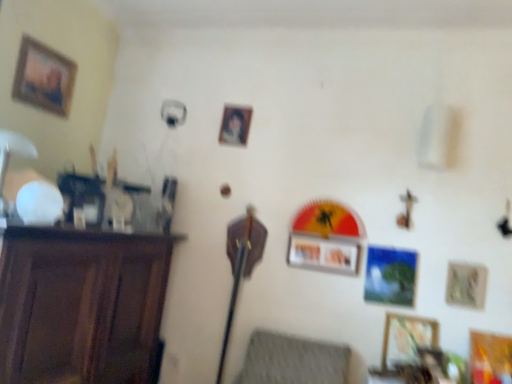
Question: Can you confirm if wooden picture frame at center, which ranks as the 4th picture frame in right-to-left order, is smaller than wooden picture frame at lower right, placed as the 3th picture frame when sorted from right to left?

Choices:
 (A) no
 (B) yes

Answer: (A)

Question: Is wooden picture frame at center, positioned as the third picture frame in left-to-right order, behind wooden picture frame at lower right, placed as the 2th picture frame when sorted from bottom to top?

Choices:
 (A) no
 (B) yes

Answer: (B)

Question: Is wooden picture frame at center, which is counted as the 4th picture frame, starting from the bottom, next to wooden picture frame at lower right, placed as the 3th picture frame when sorted from right to left, and touching it?

Choices:
 (A) no
 (B) yes

Answer: (A)

Question: Is the position of wooden picture frame at center, which is counted as the 4th picture frame, starting from the bottom, less distant than that of wooden picture frame at lower right, placed as the 2th picture frame when sorted from bottom to top?

Choices:
 (A) no
 (B) yes

Answer: (A)

Question: From a real-world perspective, is wooden picture frame at center, which is counted as the 4th picture frame, starting from the bottom, on top of wooden picture frame at lower right, arranged as the fifth picture frame when viewed from the top?

Choices:
 (A) no
 (B) yes

Answer: (B)

Question: From their relative heights in the image, would you say matte plastic picture frame at center, positioned as the 5th picture frame in right-to-left order, is taller or shorter than wooden picture frame at center, which ranks as the 4th picture frame in right-to-left order?

Choices:
 (A) tall
 (B) short

Answer: (A)

Question: From the image's perspective, is matte plastic picture frame at center, which appears as the fifth picture frame when ordered from the bottom, positioned above or below wooden picture frame at center, which is counted as the 4th picture frame, starting from the bottom?

Choices:
 (A) below
 (B) above

Answer: (B)

Question: In terms of width, does matte plastic picture frame at center, positioned as the 5th picture frame in right-to-left order, look wider or thinner when compared to wooden picture frame at center, the third picture frame viewed from the top?

Choices:
 (A) wide
 (B) thin

Answer: (B)

Question: Does point 225,105 appear closer or farther from the camera than point 358,246?

Choices:
 (A) closer
 (B) farther

Answer: (B)

Question: In the image, is dark wood cabinet at left positioned in front of or behind wooden framed portrait at upper left, positioned as the first picture frame in left-to-right order?

Choices:
 (A) front
 (B) behind

Answer: (A)

Question: In terms of height, does dark wood cabinet at left look taller or shorter compared to wooden framed portrait at upper left, arranged as the sixth picture frame when viewed from the right?

Choices:
 (A) tall
 (B) short

Answer: (A)

Question: Is dark wood cabinet at left bigger or smaller than wooden framed portrait at upper left, arranged as the sixth picture frame when viewed from the right?

Choices:
 (A) big
 (B) small

Answer: (A)

Question: Do you think dark wood cabinet at left is within wooden framed portrait at upper left, which is counted as the 1th picture frame, starting from the top, or outside of it?

Choices:
 (A) inside
 (B) outside

Answer: (B)

Question: Is point (95, 259) closer or farther from the camera than point (475, 292)?

Choices:
 (A) farther
 (B) closer

Answer: (B)

Question: From the image's perspective, is dark wood cabinet at left located above or below metallic silver picture frame at lower right, which is counted as the second picture frame, starting from the right?

Choices:
 (A) below
 (B) above

Answer: (A)